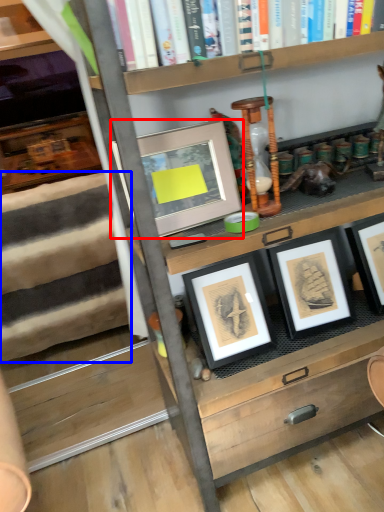
Question: Which of the following is the closest to the observer, picture frame (highlighted by a red box) or stair (highlighted by a blue box)?

Choices:
 (A) picture frame
 (B) stair

Answer: (A)